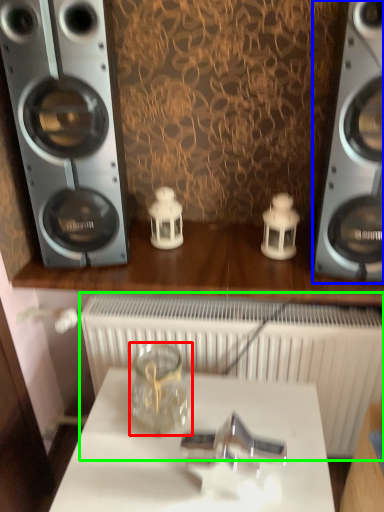
Question: Which object is positioned farthest from glass jar (highlighted by a red box)? Select from home appliance (highlighted by a blue box) and radiator (highlighted by a green box).

Choices:
 (A) home appliance
 (B) radiator

Answer: (A)